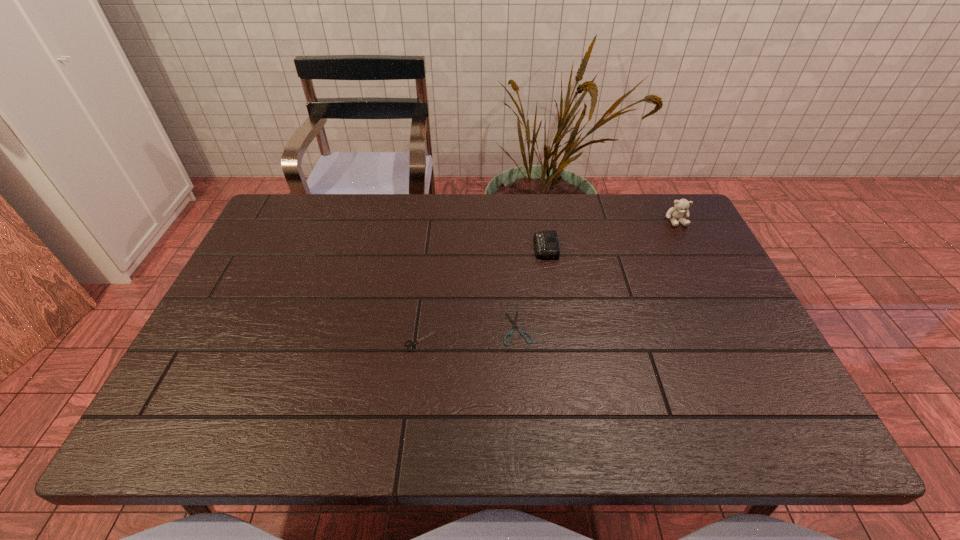
You are a GUI agent. You are given a task and a screenshot of the screen. Output one action in this format:
    pyautogui.click(x=<x>, y=<y>)
    Task: Click on the vacant area located 0.330m on the display of the alarm clock
    
    Given the screenshot: What is the action you would take?
    pyautogui.click(x=422, y=247)

Identify the location of free space located 0.320m on the display of the alarm clock. (426, 247).

The height and width of the screenshot is (540, 960). I want to click on free space located 0.320m on the left of the third tallest object, so click(x=272, y=341).

Locate an element on the screen. The width and height of the screenshot is (960, 540). free region located 0.370m on the back of the shorter shears is located at coordinates (509, 221).

You are a GUI agent. You are given a task and a screenshot of the screen. Output one action in this format:
    pyautogui.click(x=<x>, y=<y>)
    Task: Click on the teddy bear that is positioned at the far edge
    The image size is (960, 540).
    Given the screenshot: What is the action you would take?
    pyautogui.click(x=681, y=206)

Identify the location of alarm clock that is at the far edge. (546, 244).

The image size is (960, 540). I want to click on object that is at the right edge, so pos(681,206).

Locate an element on the screen. object at the far right corner is located at coordinates (681, 206).

You are a GUI agent. You are given a task and a screenshot of the screen. Output one action in this format:
    pyautogui.click(x=<x>, y=<y>)
    Task: Click on the free space at the far edge
    This screenshot has width=960, height=540.
    Given the screenshot: What is the action you would take?
    pyautogui.click(x=343, y=205)

Where is `free spot at the near edge of the desktop`? This screenshot has height=540, width=960. free spot at the near edge of the desktop is located at coordinates (564, 432).